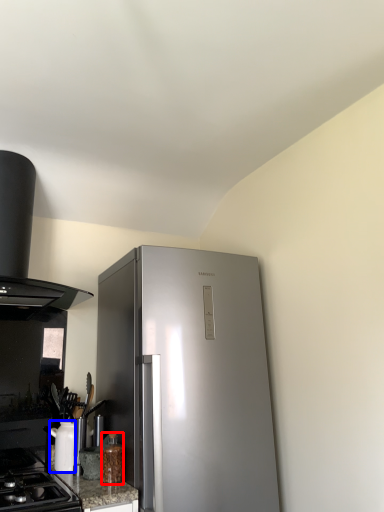
Question: Which of the following is the farthest to the observer, bottle (highlighted by a red box) or appliance (highlighted by a blue box)?

Choices:
 (A) bottle
 (B) appliance

Answer: (B)